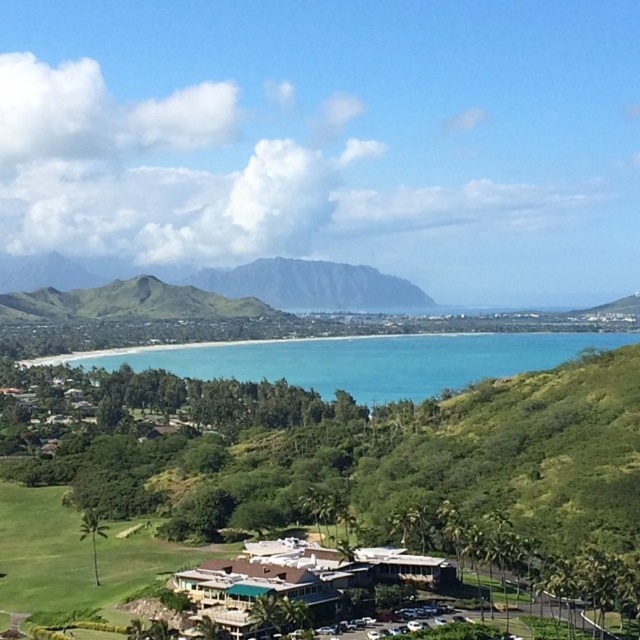
Looking at this image, you are standing at the beach and want to take a photo of both the point at coordinates (324, 262) and the point at coordinates (177, 305). Since you need to ensure both points are in focus, which point should you focus on first to capture both in your shot?

You should focus on the point at coordinates (177, 305) first because it is closer to you than the point at coordinates (324, 262), which is further away. By focusing on the closer point, both points will be in focus due to the depth of field.

You are standing at the point marked by the coordinates point (305, 284) in the image. Based on the scene description, what type of terrain are you currently standing on?

The point (305, 284) indicates green grassy mountain at center, so you are standing on a green grassy mountain.

You are standing at the edge of the beach looking towards the green grassy mountain at center. Based on your position, where would you need to walk to reach the mountain?

The green grassy mountain at center is located at point 0.445 on the x axis and 0.477 on the y axis, so you should walk towards the center of the image to reach it.